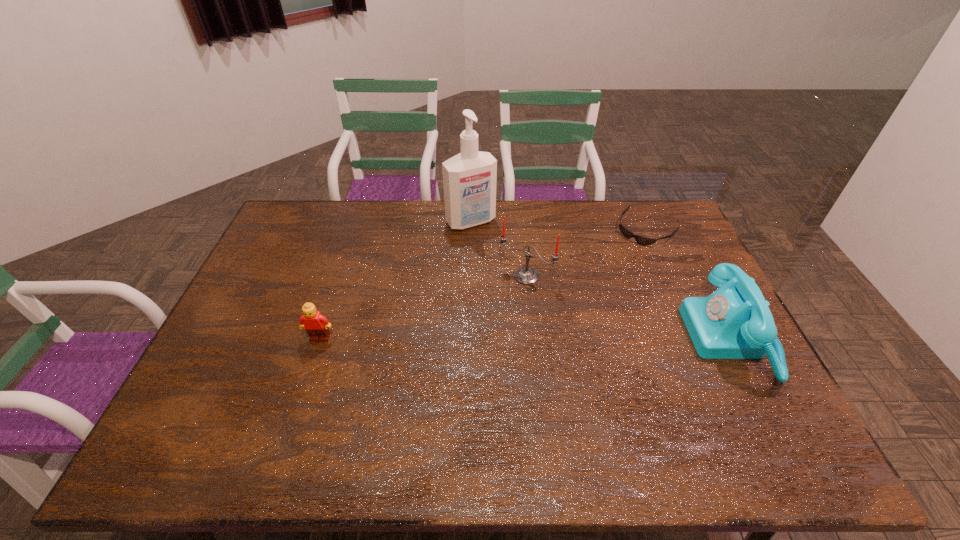
Locate an element on the screen. The height and width of the screenshot is (540, 960). empty space that is in between the telephone and the second object from left to right is located at coordinates (601, 280).

The width and height of the screenshot is (960, 540). I want to click on empty space that is in between the Lego and the telephone, so pos(526,339).

Locate an element on the screen. blank region between the Lego and the tallest object is located at coordinates pos(396,280).

Locate an element on the screen. The width and height of the screenshot is (960, 540). free point between the shortest object and the telephone is located at coordinates (689, 284).

The height and width of the screenshot is (540, 960). Find the location of `object that is the closest to the second object from left to right`. object that is the closest to the second object from left to right is located at coordinates (526, 275).

What are the coordinates of `object that can be found as the closest to the second object from left to right` in the screenshot? It's located at (526, 275).

Identify the location of free region that satisfies the following two spatial constraints: 1. on the front side of the candle; 2. on the dial of the telephone. This screenshot has height=540, width=960. (533, 339).

Where is `blank area in the image that satisfies the following two spatial constraints: 1. on the front side of the telephone; 2. on the dial of the shortest object`? blank area in the image that satisfies the following two spatial constraints: 1. on the front side of the telephone; 2. on the dial of the shortest object is located at coordinates (694, 339).

This screenshot has height=540, width=960. Identify the location of free space that satisfies the following two spatial constraints: 1. on the face of the telephone; 2. on the dial of the second shortest object. (320, 339).

You are a GUI agent. You are given a task and a screenshot of the screen. Output one action in this format:
    pyautogui.click(x=<x>, y=<y>)
    Task: Click on the blank space that satisfies the following two spatial constraints: 1. on the front side of the second object from left to right; 2. on the dial of the telephone
    The image size is (960, 540).
    Given the screenshot: What is the action you would take?
    pyautogui.click(x=468, y=339)